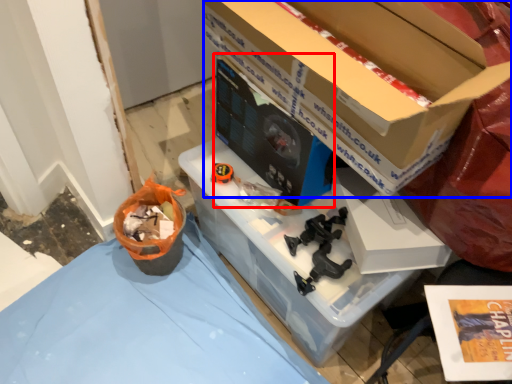
Question: Which of the following is the closest to the observer, desktop computer (highlighted by a red box) or box (highlighted by a blue box)?

Choices:
 (A) desktop computer
 (B) box

Answer: (B)